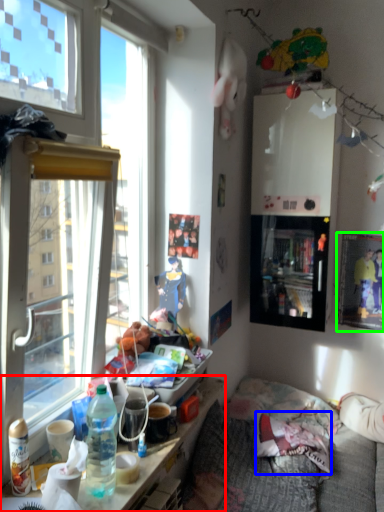
Question: Which is nearer to the cabinetry (highlighted by a red box)? pillow (highlighted by a blue box) or picture frame (highlighted by a green box).

Choices:
 (A) pillow
 (B) picture frame

Answer: (A)